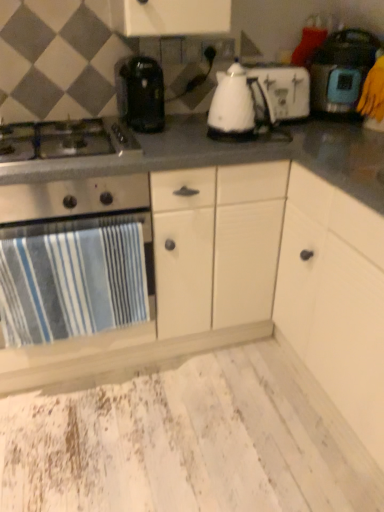
Question: Does gray matte countertop at center have a larger size compared to white plastic toaster at center, arranged as the 2th kitchen appliance when viewed from the right?

Choices:
 (A) yes
 (B) no

Answer: (A)

Question: Considering the relative sizes of gray matte countertop at center and white plastic toaster at center, arranged as the 2th kitchen appliance when viewed from the right, in the image provided, is gray matte countertop at center thinner than white plastic toaster at center, arranged as the 2th kitchen appliance when viewed from the right,?

Choices:
 (A) no
 (B) yes

Answer: (A)

Question: Is gray matte countertop at center completely or partially outside of white plastic toaster at center, which is the 2th kitchen appliance in left-to-right order?

Choices:
 (A) yes
 (B) no

Answer: (A)

Question: Is white plastic toaster at center, which is the 2th kitchen appliance in left-to-right order, inside gray matte countertop at center?

Choices:
 (A) yes
 (B) no

Answer: (B)

Question: Does gray matte countertop at center touch white plastic toaster at center, arranged as the 2th kitchen appliance when viewed from the right?

Choices:
 (A) no
 (B) yes

Answer: (A)

Question: In terms of height, does gray matte countertop at center look taller or shorter compared to white plastic toaster at center, which is the 2th kitchen appliance in left-to-right order?

Choices:
 (A) tall
 (B) short

Answer: (A)

Question: Considering their positions, is gray matte countertop at center located in front of or behind white plastic toaster at center, which is the 2th kitchen appliance in left-to-right order?

Choices:
 (A) front
 (B) behind

Answer: (A)

Question: From the image's perspective, is gray matte countertop at center positioned above or below white plastic toaster at center, arranged as the 2th kitchen appliance when viewed from the right?

Choices:
 (A) above
 (B) below

Answer: (B)

Question: In terms of width, does gray matte countertop at center look wider or thinner when compared to white plastic toaster at center, which is the 2th kitchen appliance in left-to-right order?

Choices:
 (A) thin
 (B) wide

Answer: (B)

Question: Considering the positions of gray matte countertop at center and blue striped towel at left, arranged as the 3th kitchen appliance when viewed from the right, in the image, is gray matte countertop at center taller or shorter than blue striped towel at left, arranged as the 3th kitchen appliance when viewed from the right,?

Choices:
 (A) short
 (B) tall

Answer: (B)

Question: From a real-world perspective, is gray matte countertop at center positioned above or below blue striped towel at left, arranged as the 3th kitchen appliance when viewed from the right?

Choices:
 (A) below
 (B) above

Answer: (A)

Question: Choose the correct answer: Is gray matte countertop at center inside blue striped towel at left, the 1th kitchen appliance positioned from the left, or outside it?

Choices:
 (A) outside
 (B) inside

Answer: (A)

Question: Considering the positions of gray matte countertop at center and blue striped towel at left, the 1th kitchen appliance positioned from the left, in the image, is gray matte countertop at center wider or thinner than blue striped towel at left, the 1th kitchen appliance positioned from the left,?

Choices:
 (A) thin
 (B) wide

Answer: (B)

Question: Considering the positions of white plastic toaster at center, arranged as the 2th kitchen appliance when viewed from the right, and stainless steel gas stove at left in the image, is white plastic toaster at center, arranged as the 2th kitchen appliance when viewed from the right, taller or shorter than stainless steel gas stove at left?

Choices:
 (A) short
 (B) tall

Answer: (B)

Question: Is point (226, 120) positioned closer to the camera than point (82, 126)?

Choices:
 (A) farther
 (B) closer

Answer: (B)